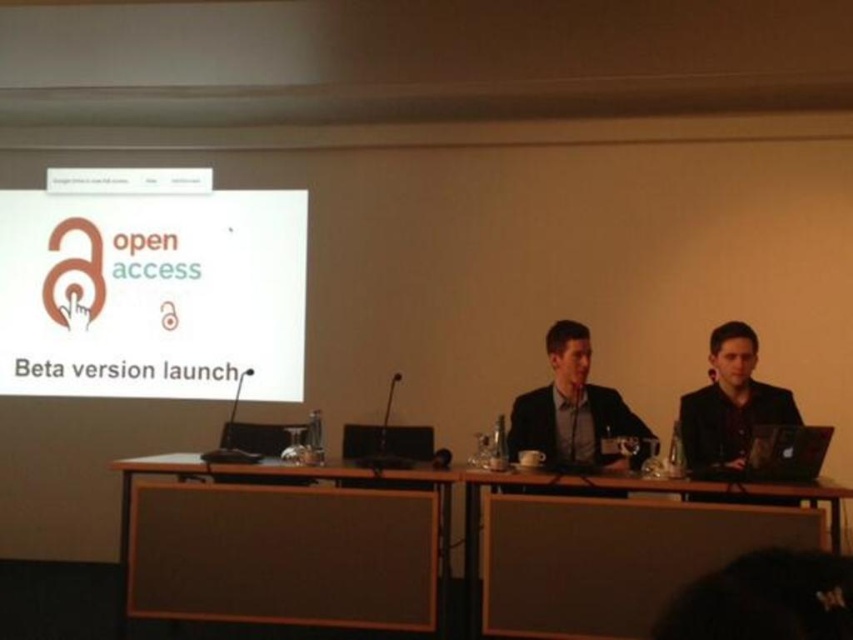
Consider the image. Can you confirm if brown fabric table at center is thinner than dark brown suit at right?

No, brown fabric table at center is not thinner than dark brown suit at right.

Between brown fabric table at center and dark brown suit at right, which one is positioned lower?

brown fabric table at center is below.

You are a GUI agent. You are given a task and a screenshot of the screen. Output one action in this format:
    pyautogui.click(x=<x>, y=<y>)
    Task: Click on the brown fabric table at center
    
    Given the screenshot: What is the action you would take?
    pyautogui.click(x=283, y=547)

Find the location of a particular element. The width and height of the screenshot is (853, 640). brown fabric table at center is located at coordinates (283, 547).

Which is below, brown fabric table at center or wooden table at center?

brown fabric table at center is lower down.

Who is higher up, brown fabric table at center or wooden table at center?

wooden table at center is above.

What do you see at coordinates (283, 547) in the screenshot?
I see `brown fabric table at center` at bounding box center [283, 547].

Locate an element on the screen. This screenshot has width=853, height=640. brown fabric table at center is located at coordinates (283, 547).

Does wooden table at center appear under dark brown suit at right?

Yes, wooden table at center is below dark brown suit at right.

Does wooden table at center have a lesser width compared to dark brown suit at right?

In fact, wooden table at center might be wider than dark brown suit at right.

The image size is (853, 640). What do you see at coordinates (611, 548) in the screenshot? I see `wooden table at center` at bounding box center [611, 548].

You are a GUI agent. You are given a task and a screenshot of the screen. Output one action in this format:
    pyautogui.click(x=<x>, y=<y>)
    Task: Click on the wooden table at center
    The image size is (853, 640).
    Given the screenshot: What is the action you would take?
    pyautogui.click(x=611, y=548)